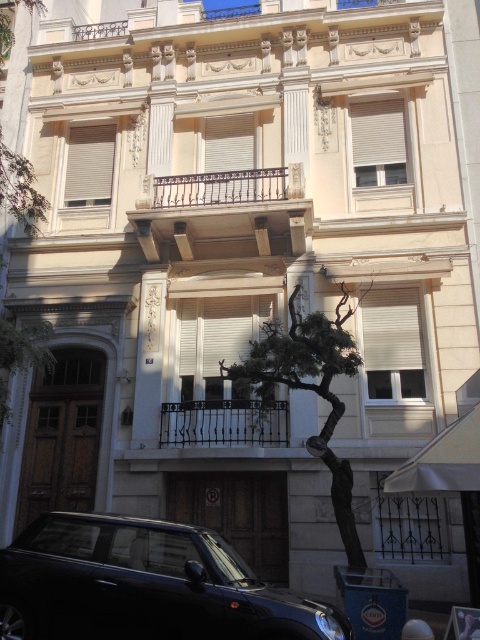
You are standing in front of the building and want to take a photo of the shiny black car at lower left without including the building in the frame. Can you step back enough to do this?

The shiny black car at lower left is 15.01 feet from viewer. Since it is relatively close, stepping back might bring the building into the frame. To exclude the building, you would need to move closer to the car or use a zoom lens to focus solely on the car.

You are a delivery person approaching the building and need to park your vehicle. The shiny black car at lower left is currently blocking the entrance. Can you estimate whether there is enough space to maneuver around it and park without obstructing the entrance?

The shiny black car at lower left is located at point (144, 586), which might be close to the entrance. However, without specific spatial dimensions or clearance details, it is difficult to accurately determine if there is enough space to maneuver around it. Please check the exact positioning and available space before attempting to park.

You are a delivery person standing in front of the building. You need to park your vehicle, which is the same size as the shiny black car at lower left. There is a parking spot next to the green textured tree at center. Will your vehicle fit in that spot?

The shiny black car at lower left has a smaller size compared to green textured tree at center. Since your vehicle is the same size as the shiny black car at lower left, it should fit in the parking spot next to the green textured tree at center.